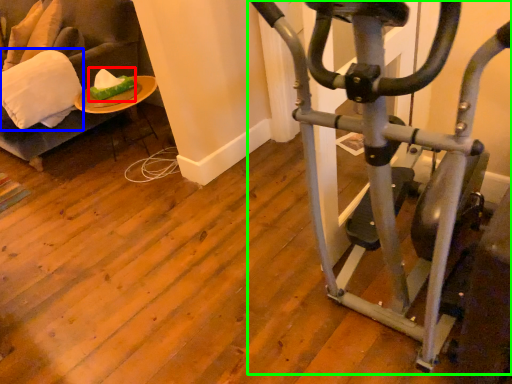
Question: Which is nearer to the food (highlighted by a red box)? pillow (highlighted by a blue box) or stationary bicycle (highlighted by a green box).

Choices:
 (A) pillow
 (B) stationary bicycle

Answer: (A)